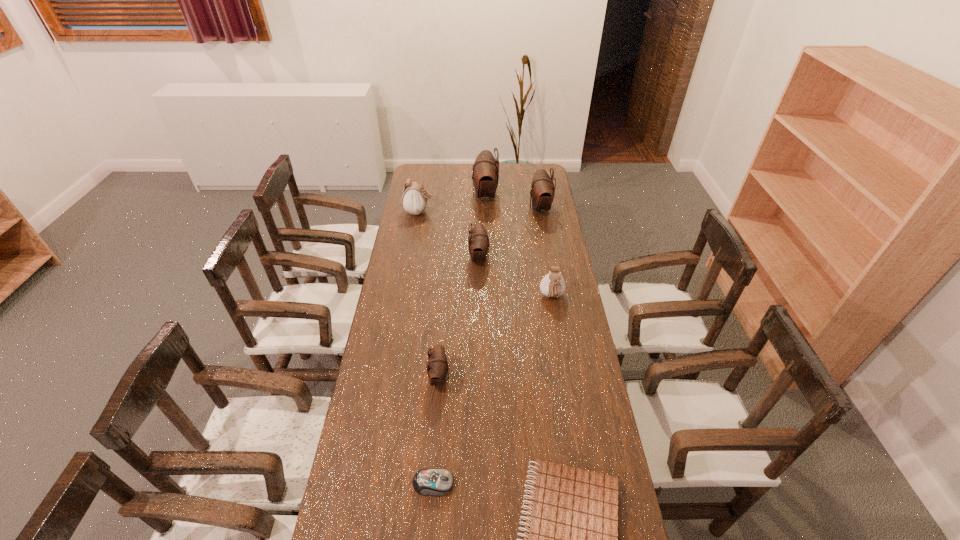
Locate an element on the screen. The width and height of the screenshot is (960, 540). free region located on the front-facing side of the nearer white pouch is located at coordinates (565, 381).

Identify the location of free space located with the flap open on the smallest brown pouch. This screenshot has height=540, width=960. (531, 377).

Locate an element on the screen. vacant position located on the wheel side of the computer mouse is located at coordinates (475, 483).

Locate an element on the screen. The height and width of the screenshot is (540, 960). object at the far edge is located at coordinates (485, 175).

The height and width of the screenshot is (540, 960). What are the coordinates of `object present at the left edge` in the screenshot? It's located at (414, 200).

Image resolution: width=960 pixels, height=540 pixels. In the image, there is a desktop. What are the coordinates of `vacant space at the far edge` in the screenshot? It's located at (470, 185).

This screenshot has height=540, width=960. In the image, there is a desktop. Find the location of `vacant space at the left edge`. vacant space at the left edge is located at coordinates (418, 218).

Locate an element on the screen. This screenshot has height=540, width=960. free space at the right edge of the desktop is located at coordinates (566, 424).

This screenshot has height=540, width=960. In order to click on free space between the tallest pouch and the left white pouch in this screenshot , I will do `click(452, 204)`.

Locate an element on the screen. This screenshot has width=960, height=540. free space that is in between the rightmost brown pouch and the fifth farthest pouch is located at coordinates (546, 252).